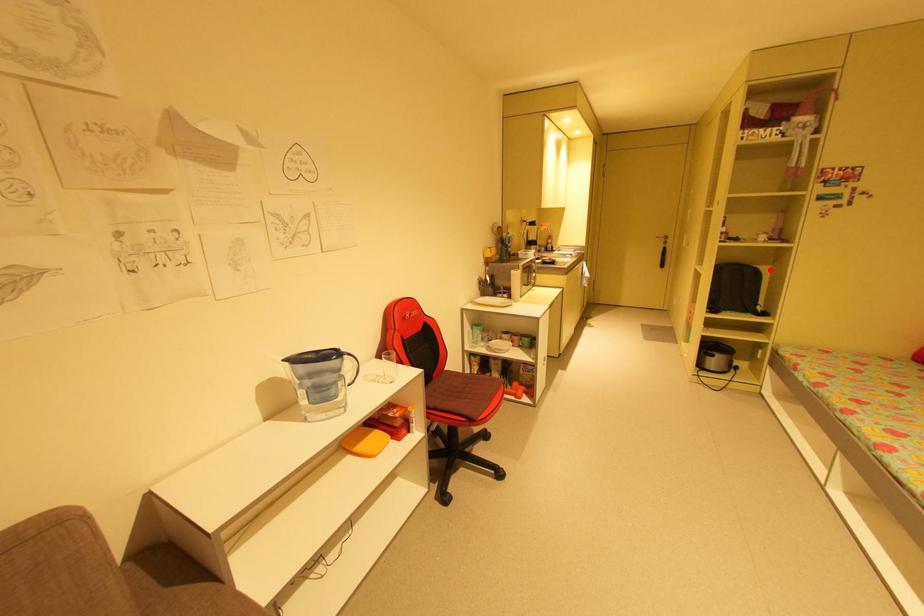
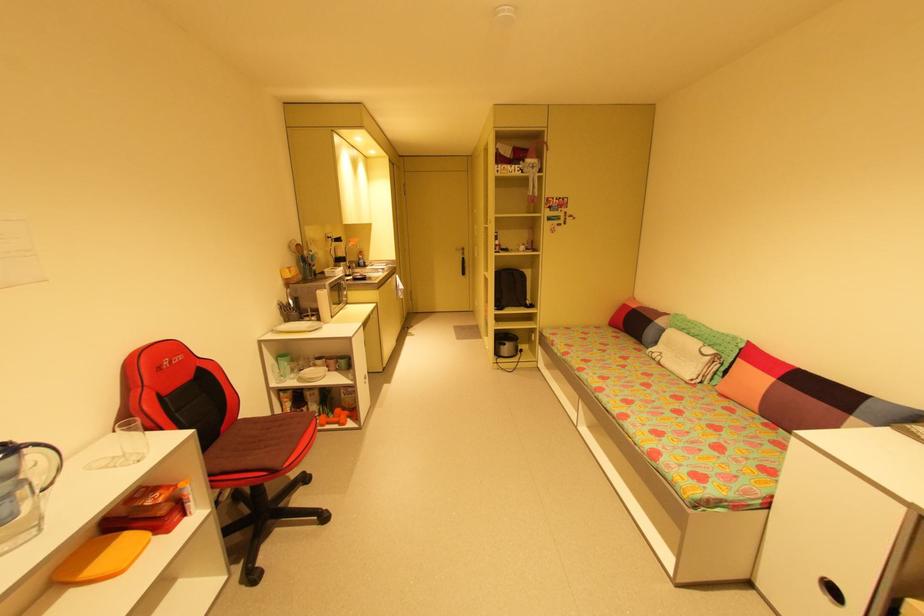
Question: I am providing you with two images of the same scene from different viewpoints. A red point is marked on the first image. At the location where the point appears in image 1, is it still visible in image 2?

Choices:
 (A) Yes
 (B) No

Answer: (A)